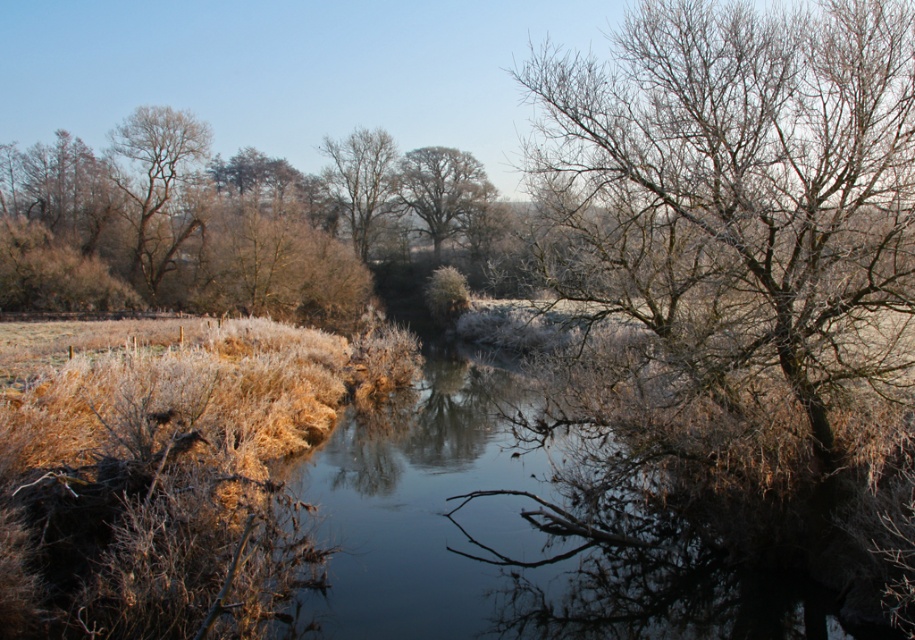
You are standing at the point labeled point [741,150] and want to walk to the point labeled point [141,211]. Which direction should you move in to get closer to your destination?

You should move downward because point [741,150] is closer to the camera than point [141,211], meaning it is higher up in the image. To reach the lower point, you need to move downward.

You are a hiker trying to cross the river. You see the frosted branches at upper right and the bare wood tree at center. Which one is farther away from your current position?

The frosted branches at upper right are farther away from your current position than the bare wood tree at center because the distance between them is 60.35 meters.